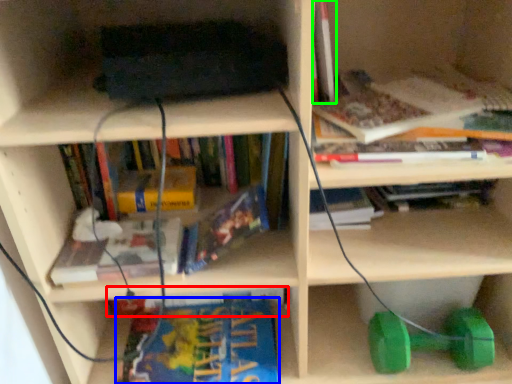
Question: Considering the real-world distances, which object is closest to book (highlighted by a red box)? book (highlighted by a blue box) or book (highlighted by a green box).

Choices:
 (A) book
 (B) book

Answer: (A)